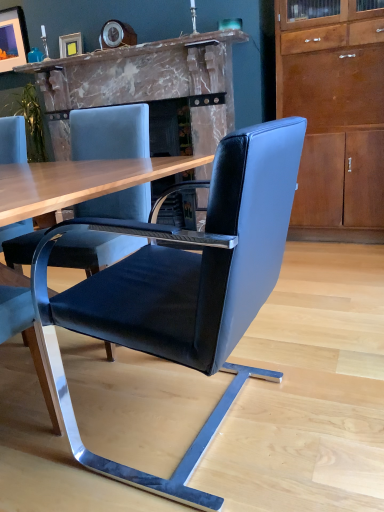
Question: Is black leather chair at center oriented towards marble fireplace at center?

Choices:
 (A) no
 (B) yes

Answer: (A)

Question: Does black leather chair at center contain marble fireplace at center?

Choices:
 (A) yes
 (B) no

Answer: (B)

Question: From the image's perspective, is black leather chair at center on top of marble fireplace at center?

Choices:
 (A) no
 (B) yes

Answer: (A)

Question: Does black leather chair at center lie in front of marble fireplace at center?

Choices:
 (A) yes
 (B) no

Answer: (A)

Question: Is black leather chair at center with marble fireplace at center?

Choices:
 (A) yes
 (B) no

Answer: (B)

Question: From a real-world perspective, is black leather chair at center on marble fireplace at center?

Choices:
 (A) no
 (B) yes

Answer: (A)

Question: Is matte black picture frame at upper left, the 1th picture frame viewed from the top, outside of matte brown cabinet at right?

Choices:
 (A) no
 (B) yes

Answer: (B)

Question: From a real-world perspective, does matte black picture frame at upper left, acting as the second picture frame starting from the bottom, sit lower than matte brown cabinet at right?

Choices:
 (A) yes
 (B) no

Answer: (B)

Question: Does matte black picture frame at upper left, the 2th picture frame when ordered from right to left, appear on the right side of matte brown cabinet at right?

Choices:
 (A) yes
 (B) no

Answer: (B)

Question: Can you confirm if matte black picture frame at upper left, which ranks as the 1th picture frame in left-to-right order, is thinner than matte brown cabinet at right?

Choices:
 (A) no
 (B) yes

Answer: (B)

Question: Would you consider matte black picture frame at upper left, which is the second picture frame from front to back, to be distant from matte brown cabinet at right?

Choices:
 (A) yes
 (B) no

Answer: (A)

Question: Can you confirm if matte black picture frame at upper left, the 2th picture frame when ordered from right to left, is taller than matte brown cabinet at right?

Choices:
 (A) no
 (B) yes

Answer: (A)

Question: Is black leather chair at center smaller than teal glass at upper center?

Choices:
 (A) no
 (B) yes

Answer: (A)